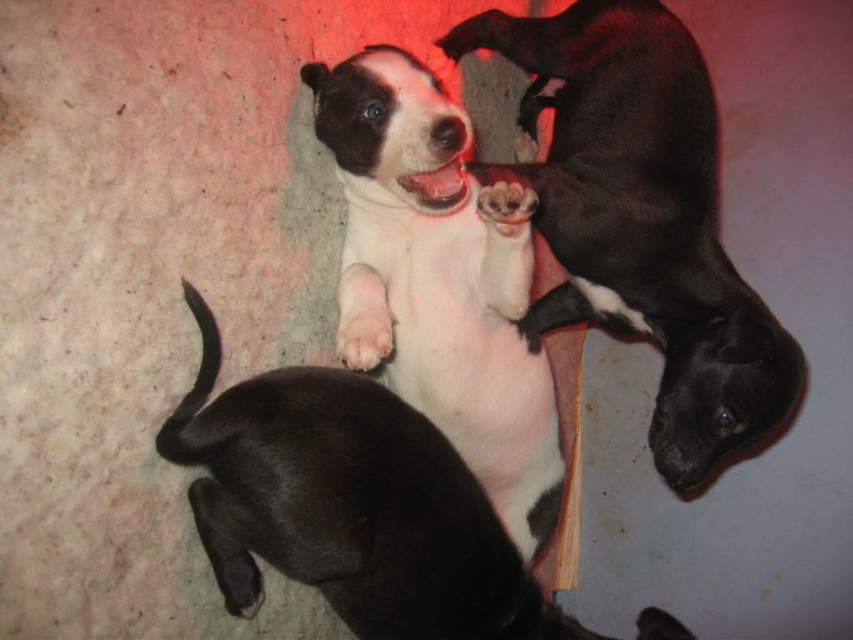
Is point (563, 134) closer to viewer compared to point (375, 170)?

No, it is not.

Who is more distant from viewer, (579, 147) or (410, 337)?

Point (579, 147)

Find the location of `white smooth puppy at center`. white smooth puppy at center is located at coordinates (641, 218).

Between white smooth puppy at center and white soft fur at center, which one appears on the left side from the viewer's perspective?

white soft fur at center

Does point (546, 92) come in front of point (213, 404)?

No.

Identify the location of white smooth puppy at center. (641, 218).

Which is below, white smooth puppy at center or white soft paw at center?

white soft paw at center is lower down.

Can you confirm if white smooth puppy at center is thinner than white soft paw at center?

No.

The width and height of the screenshot is (853, 640). What are the coordinates of `white smooth puppy at center` in the screenshot? It's located at (641, 218).